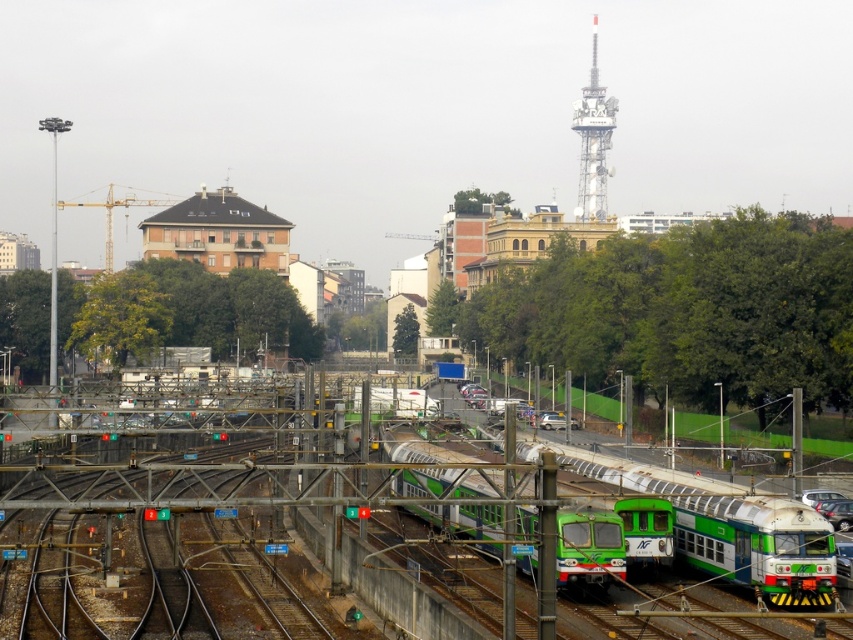
Question: Is the position of green matte train at center more distant than that of metallic gray tower at upper center?

Choices:
 (A) no
 (B) yes

Answer: (A)

Question: Which of the following is the farthest from the observer?

Choices:
 (A) green matte train at center
 (B) green metallic train at center
 (C) metallic gray tower at upper center

Answer: (C)

Question: Which point is closer to the camera taking this photo?

Choices:
 (A) (607, 465)
 (B) (590, 147)

Answer: (A)

Question: Which point is farther to the camera?

Choices:
 (A) green metallic train at center
 (B) green matte train at center

Answer: (B)

Question: Can you confirm if green metallic train at center is thinner than metallic gray tower at upper center?

Choices:
 (A) no
 (B) yes

Answer: (B)

Question: Can you confirm if green matte train at center is bigger than green metallic train at center?

Choices:
 (A) yes
 (B) no

Answer: (B)